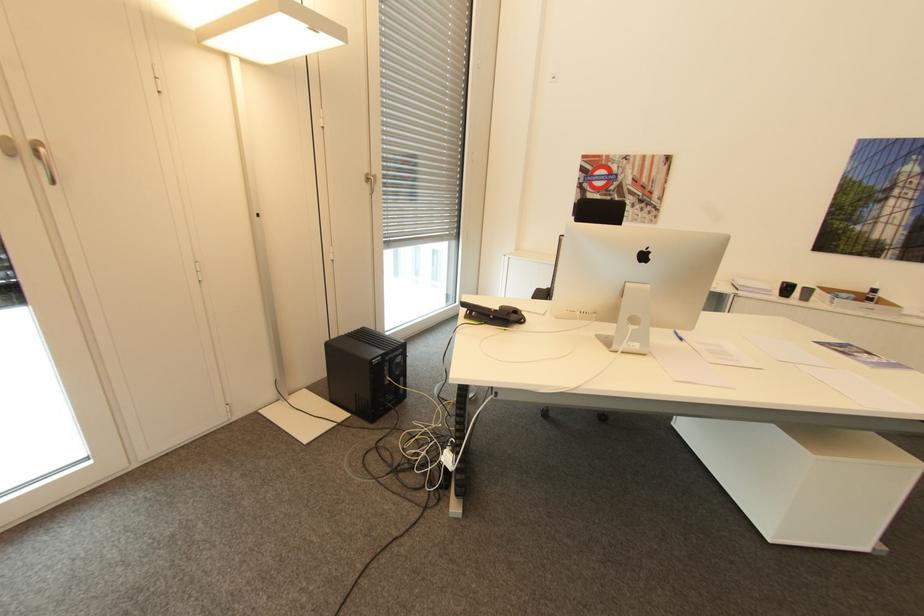
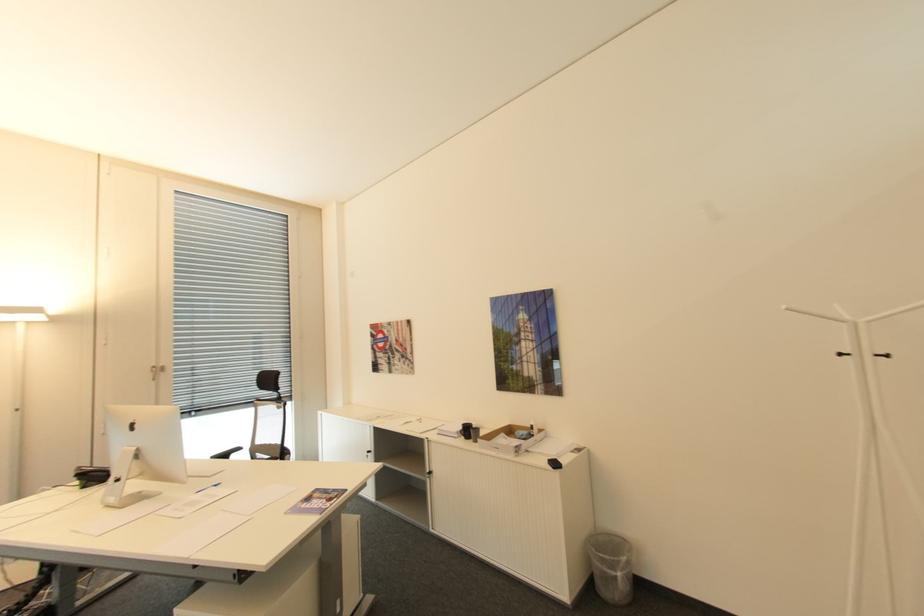
The point at (372, 175) is marked in the first image. Where is the corresponding point in the second image?

(159, 367)